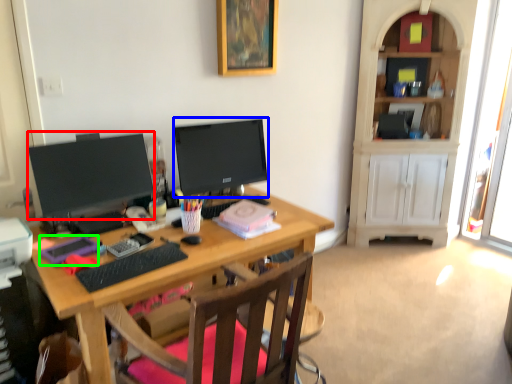
Question: Which object is positioned closest to television (highlighted by a red box)? Select from television (highlighted by a blue box) and stationery (highlighted by a green box).

Choices:
 (A) television
 (B) stationery

Answer: (B)